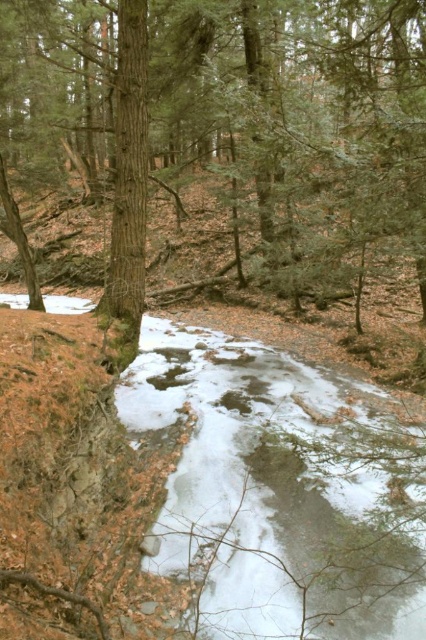
Question: Does brown wood tree at center appear on the right side of white frozen stream at center?

Choices:
 (A) yes
 (B) no

Answer: (B)

Question: Among these objects, which one is farthest from the camera?

Choices:
 (A) brown wood tree at center
 (B) white frozen stream at center

Answer: (A)

Question: Is brown wood tree at center wider than white frozen stream at center?

Choices:
 (A) yes
 (B) no

Answer: (A)

Question: Can you confirm if brown wood tree at center is wider than white frozen stream at center?

Choices:
 (A) yes
 (B) no

Answer: (A)

Question: Which point is farther from the camera taking this photo?

Choices:
 (A) (273, 180)
 (B) (178, 561)

Answer: (A)